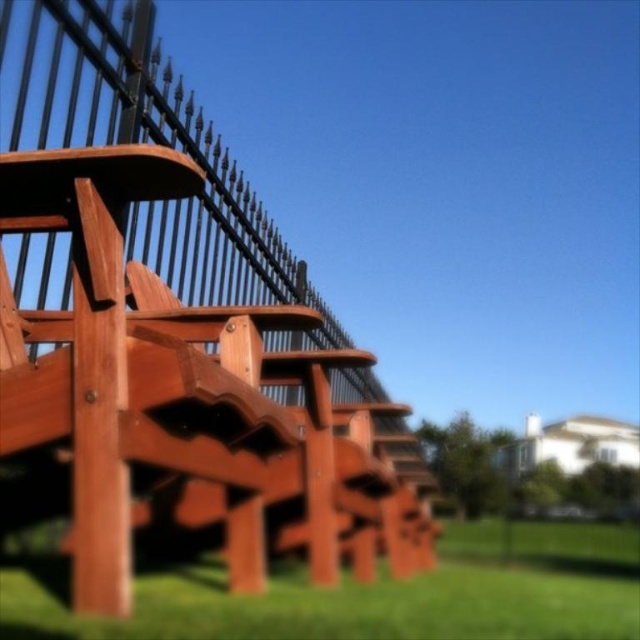
Question: Which point appears closest to the camera in this image?

Choices:
 (A) (308, 284)
 (B) (296, 573)

Answer: (B)

Question: Which of the following is the closest to the observer?

Choices:
 (A) (234, 636)
 (B) (180, 236)

Answer: (A)

Question: Is brown wood fence at upper left closer to the viewer compared to green grass at lower center?

Choices:
 (A) no
 (B) yes

Answer: (A)

Question: Can you confirm if brown wood fence at upper left is positioned to the left of green grass at lower center?

Choices:
 (A) no
 (B) yes

Answer: (B)

Question: Does brown wood fence at upper left have a lesser width compared to green grass at lower center?

Choices:
 (A) yes
 (B) no

Answer: (A)